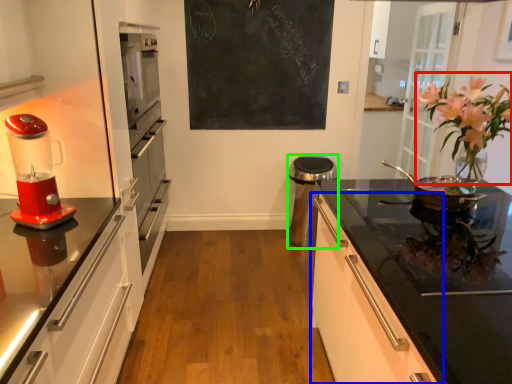
Question: Which object is positioned closest to floral arrangement (highlighted by a red box)? Select from cabinetry (highlighted by a blue box) and appliance (highlighted by a green box).

Choices:
 (A) cabinetry
 (B) appliance

Answer: (A)